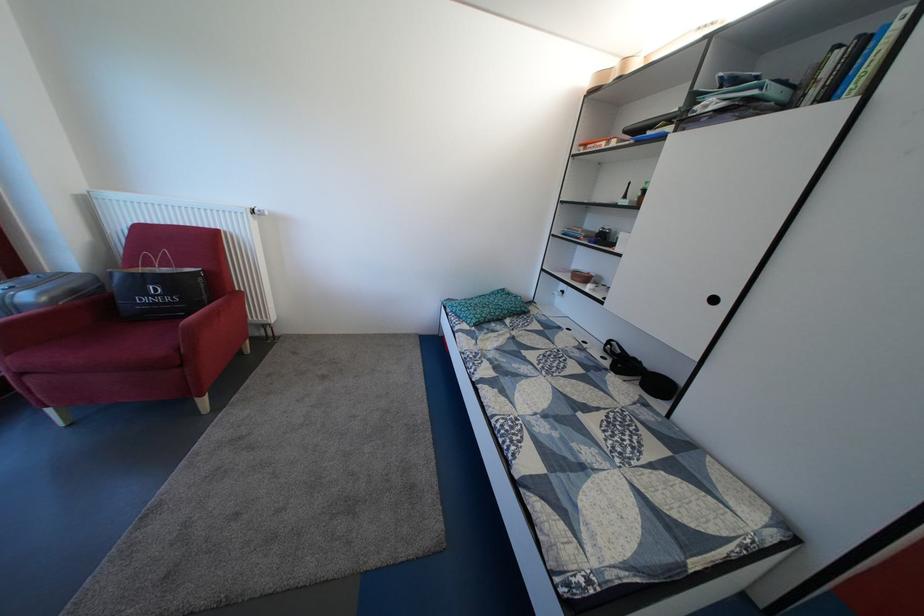
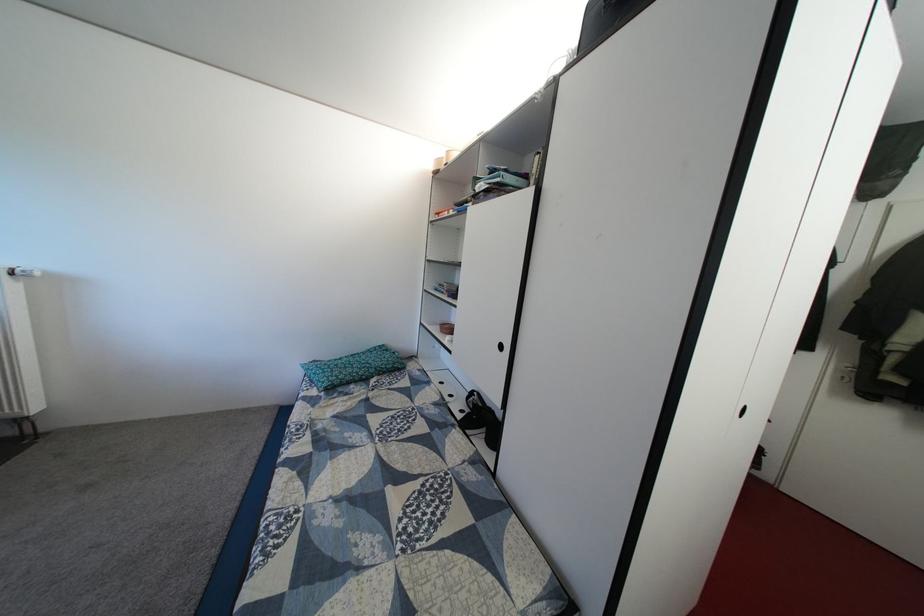
Question: The images are taken continuously from a first-person perspective. In which direction is your viewpoint rotating?

Choices:
 (A) Left
 (B) Right
 (C) Up
 (D) Down

Answer: (C)